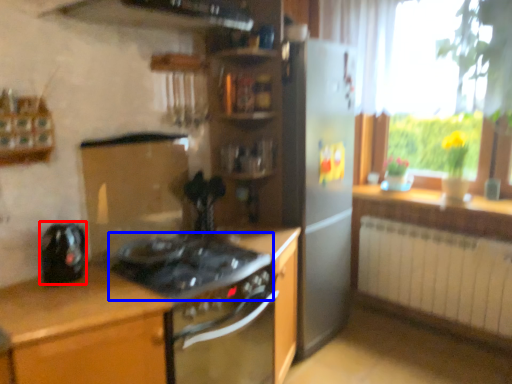
Question: Which object appears farthest to the camera in this image, kitchen appliance (highlighted by a red box) or gas stove (highlighted by a blue box)?

Choices:
 (A) kitchen appliance
 (B) gas stove

Answer: (A)